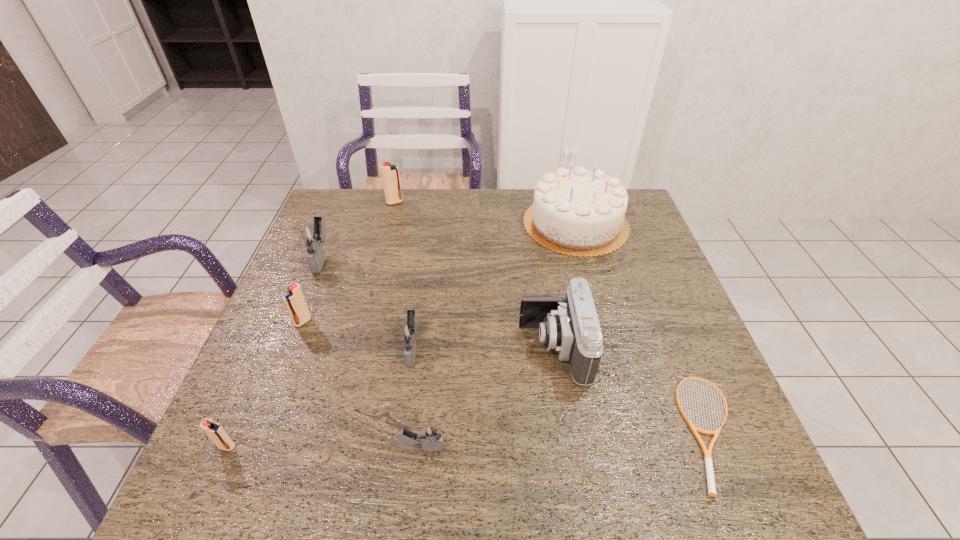
Locate an element on the screen. This screenshot has height=540, width=960. vacant space located at the front of the camera with an open lens cover is located at coordinates (498, 348).

This screenshot has height=540, width=960. Find the location of `vacant region located 0.110m on the front of the third nearest igniter`. vacant region located 0.110m on the front of the third nearest igniter is located at coordinates pos(404,413).

This screenshot has width=960, height=540. Find the location of `vacant region located on the front of the second red igniter from left to right`. vacant region located on the front of the second red igniter from left to right is located at coordinates (278, 384).

Locate an element on the screen. vacant space located on the right of the leftmost red igniter is located at coordinates (313, 447).

At what (x,y) coordinates should I click in order to perform the action: click on vacant space located on the right of the smallest gray igniter. Please return your answer as a coordinate pair (x, y). The image size is (960, 540). Looking at the image, I should click on (567, 448).

Where is `blank area located 0.330m on the left of the tennis racket`? The height and width of the screenshot is (540, 960). blank area located 0.330m on the left of the tennis racket is located at coordinates (518, 431).

At what (x,y) coordinates should I click in order to perform the action: click on birthday cake situated at the far edge. Please return your answer as a coordinate pair (x, y). The width and height of the screenshot is (960, 540). Looking at the image, I should click on (576, 212).

The image size is (960, 540). Find the location of `igniter that is positioned at the far edge`. igniter that is positioned at the far edge is located at coordinates (390, 173).

The height and width of the screenshot is (540, 960). What are the coordinates of `igniter that is at the near edge` in the screenshot? It's located at (431, 438).

This screenshot has height=540, width=960. Find the location of `tennis racket that is at the near edge`. tennis racket that is at the near edge is located at coordinates click(707, 453).